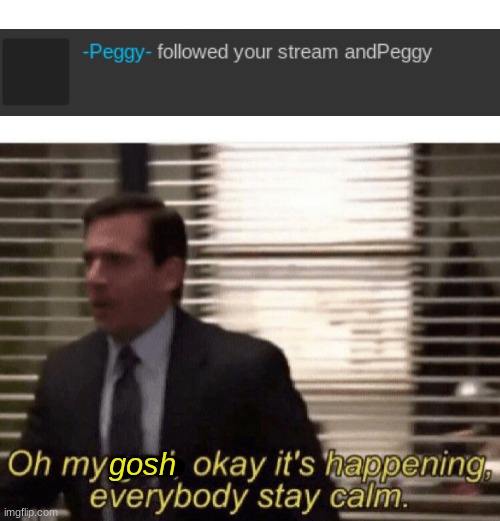
What are the coordinates of `coat` in the screenshot? It's located at (463, 287).